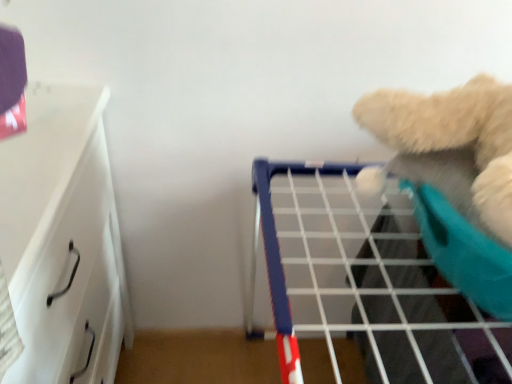
Question: Considering the relative positions of white wire shelf at upper right and white glossy drawer at left in the image provided, is white wire shelf at upper right to the left or to the right of white glossy drawer at left?

Choices:
 (A) right
 (B) left

Answer: (A)

Question: In the image, is white wire shelf at upper right positioned in front of or behind white glossy drawer at left?

Choices:
 (A) front
 (B) behind

Answer: (B)

Question: Which is farther from the fluffy white teddy bear at upper right?

Choices:
 (A) white wire shelf at upper right
 (B) white glossy drawer at left

Answer: (B)

Question: Estimate the real-world distances between objects in this image. Which object is closer to the white glossy drawer at left?

Choices:
 (A) fluffy white teddy bear at upper right
 (B) white wire shelf at upper right

Answer: (B)